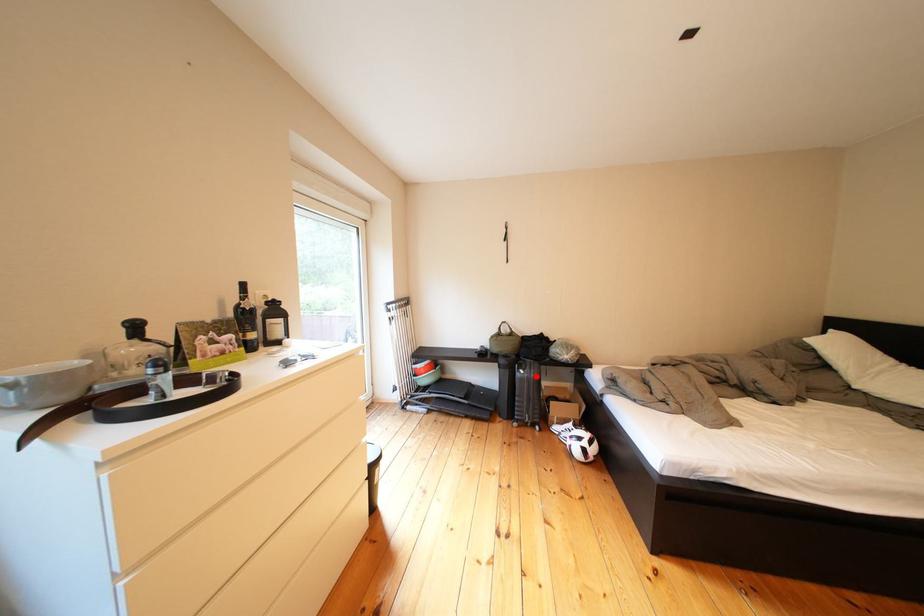
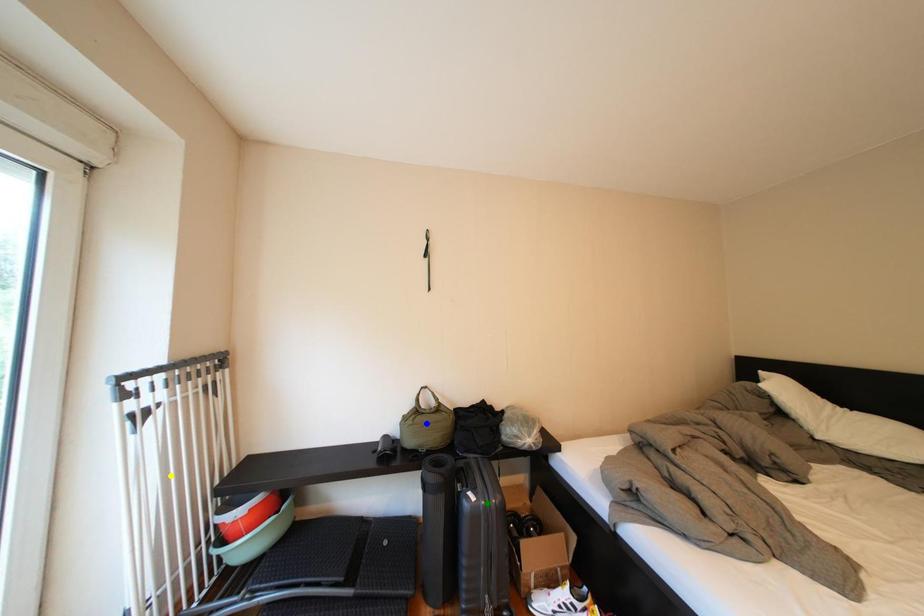
Question: I am providing you with two images of the same scene from different viewpoints. A red point is marked on the first image. You are given multiple points on the second image. Can you choose the point in image 2 that corresponds to the point in image 1?

Choices:
 (A) blue point
 (B) green point
 (C) yellow point

Answer: (B)